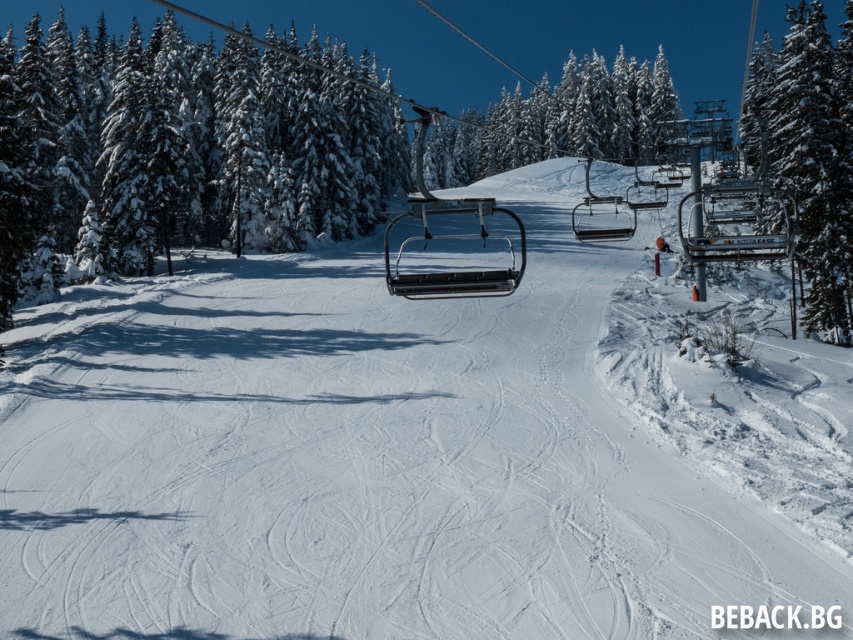
You are planning to take a photo of the ski resort scene. You want to capture both the metallic black ski lift at center and the metallic silver chairlift at center in your frame. Which one of these two objects appears smaller in the photo?

The metallic black ski lift at center appears smaller in the photo because it has a smaller size compared to the metallic silver chairlift at center.